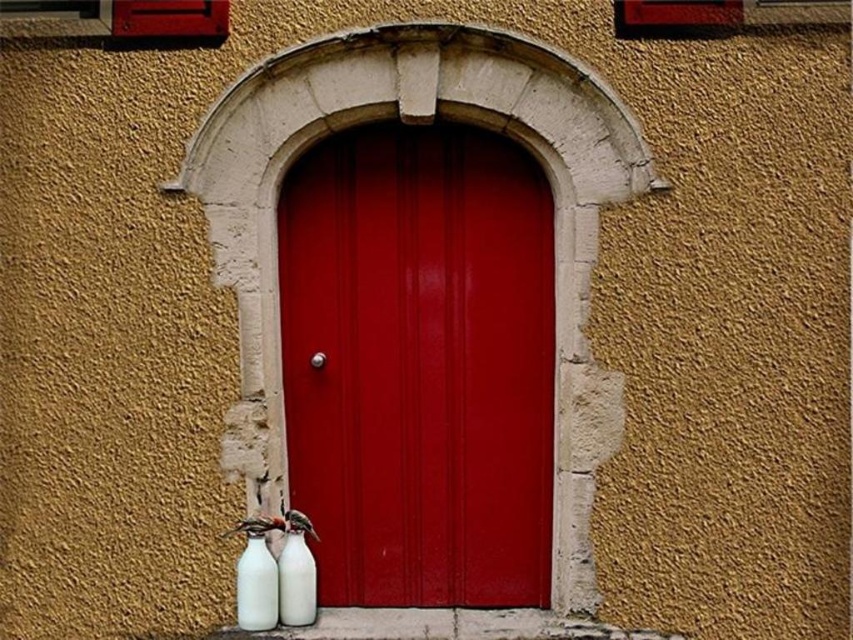
You are a delivery person who needs to place a third milk bottle on the ledge where the white matte bottle at lower left and white glossy bottle at lower center are already placed. Considering their sizes, which existing bottle should you place the new bottle next to to ensure stability?

The white matte bottle at lower left is larger in size than the white glossy bottle at lower center, so placing the new bottle next to the white matte bottle at lower left would provide better stability due to its larger base.

You are standing in front of the scene and want to place a small plant between the glossy wood door at center and the white matte bottle at lower left. Based on their positions, where should you place the plant?

The glossy wood door at center is positioned on the right side of white matte bottle at lower left, so you should place the plant between them to the left of the glossy wood door at center and to the right of the white matte bottle at lower left.